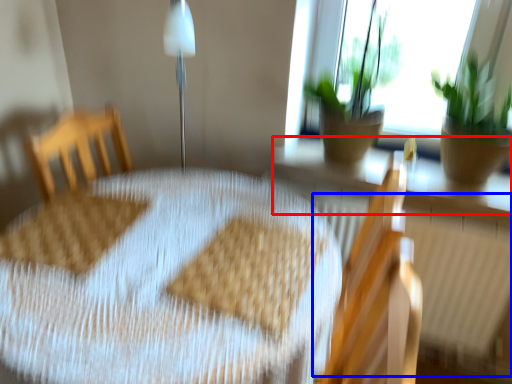
Question: Which object appears closest to the camera in this image, window sill (highlighted by a red box) or radiator (highlighted by a blue box)?

Choices:
 (A) window sill
 (B) radiator

Answer: (B)